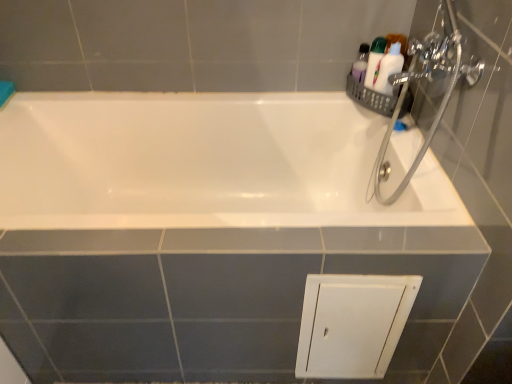
Question: In the image, is chrome metallic showerhead at upper right on the left side or the right side of white glossy toiletries at upper right, acting as the 2th toiletry starting from the right?

Choices:
 (A) right
 (B) left

Answer: (A)

Question: Does point (398, 97) appear closer or farther from the camera than point (385, 41)?

Choices:
 (A) farther
 (B) closer

Answer: (B)

Question: Which object is positioned closest to the chrome metallic showerhead at upper right?

Choices:
 (A) white plastic bottle at upper right, the 2th toiletry positioned from the left
 (B) white glossy toiletries at upper right, the 1th toiletry in the left-to-right sequence

Answer: (A)

Question: Based on their relative distances, which object is farther from the chrome metallic showerhead at upper right?

Choices:
 (A) white plastic bottle at upper right, arranged as the first toiletry when viewed from the right
 (B) white glossy toiletries at upper right, acting as the 2th toiletry starting from the right

Answer: (B)